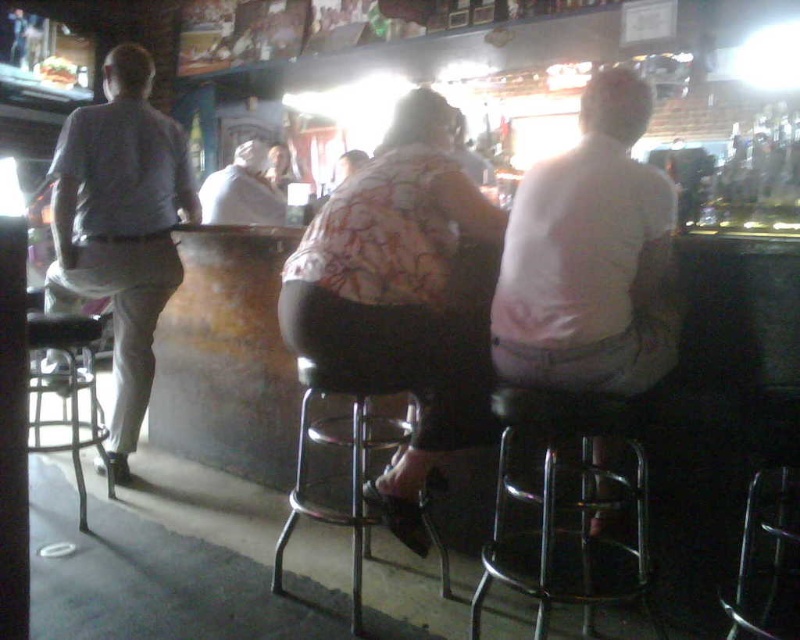
Does point (329, 392) come closer to viewer compared to point (204, 202)?

Yes, point (329, 392) is in front of point (204, 202).

From the picture: Between metallic silver bar stool at lower center and white cotton shirt at center, which one has less height?

With less height is white cotton shirt at center.

Is point (288, 525) farther from viewer compared to point (258, 160)?

No, it is in front of (258, 160).

At what (x,y) coordinates should I click in order to perform the action: click on metallic silver bar stool at lower center. Please return your answer as a coordinate pair (x, y). Looking at the image, I should click on (350, 458).

The height and width of the screenshot is (640, 800). Describe the element at coordinates (410, 285) in the screenshot. I see `floral fabric blouse at center` at that location.

Is floral fabric blouse at center wider than metallic chrome bar stool at lower right?

Yes.

Is point (389, 276) in front of point (584, 413)?

No, it is not.

The width and height of the screenshot is (800, 640). Find the location of `floral fabric blouse at center`. floral fabric blouse at center is located at coordinates (410, 285).

Measure the distance between white matte shirt at center and camera.

A distance of 1.56 meters exists between white matte shirt at center and camera.

Locate an element on the screen. This screenshot has width=800, height=640. white matte shirt at center is located at coordinates (590, 257).

Who is more distant from viewer, (570, 179) or (478, 612)?

Point (478, 612)

This screenshot has width=800, height=640. What are the coordinates of `white matte shirt at center` in the screenshot? It's located at (590, 257).